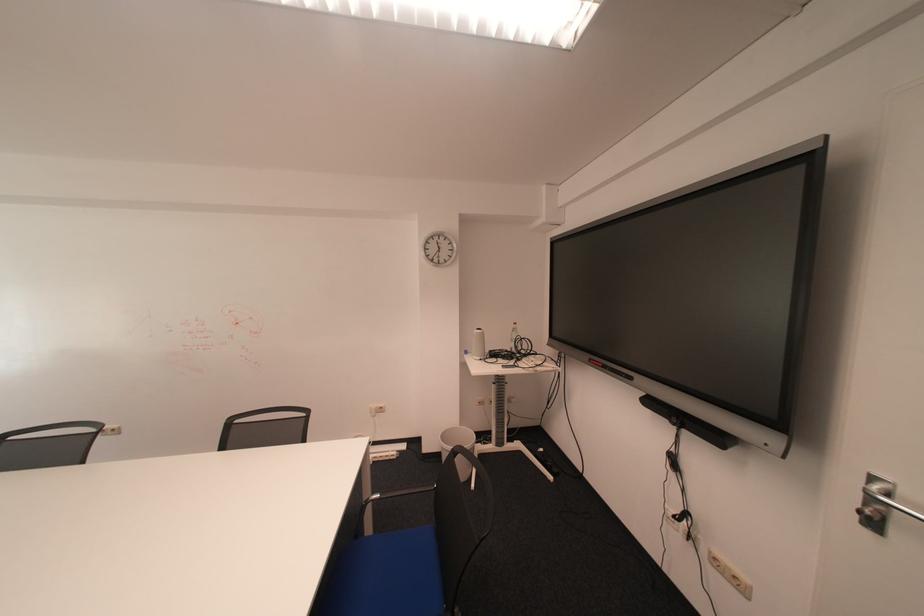
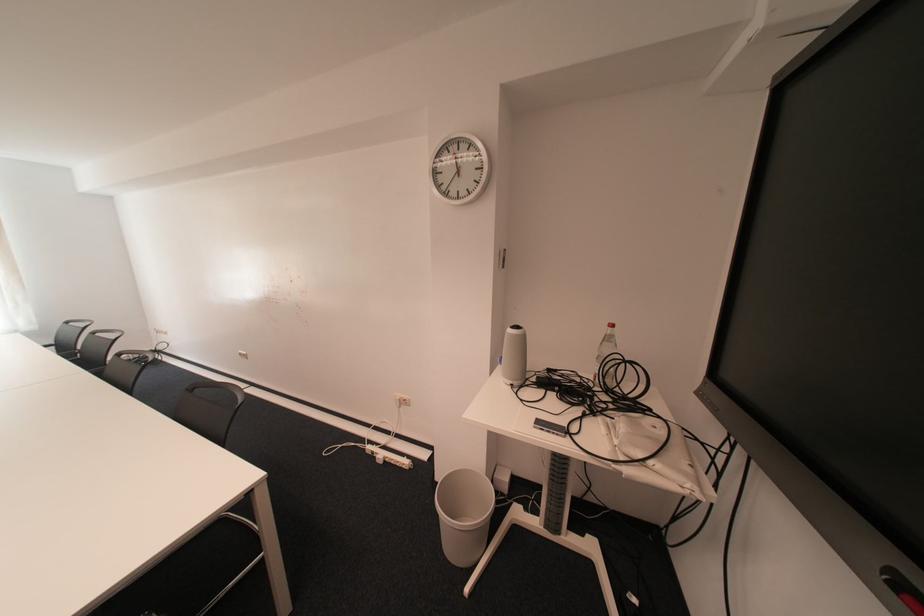
Find the pixel in the second image that matches the point at 444,261 in the first image.

(457, 195)